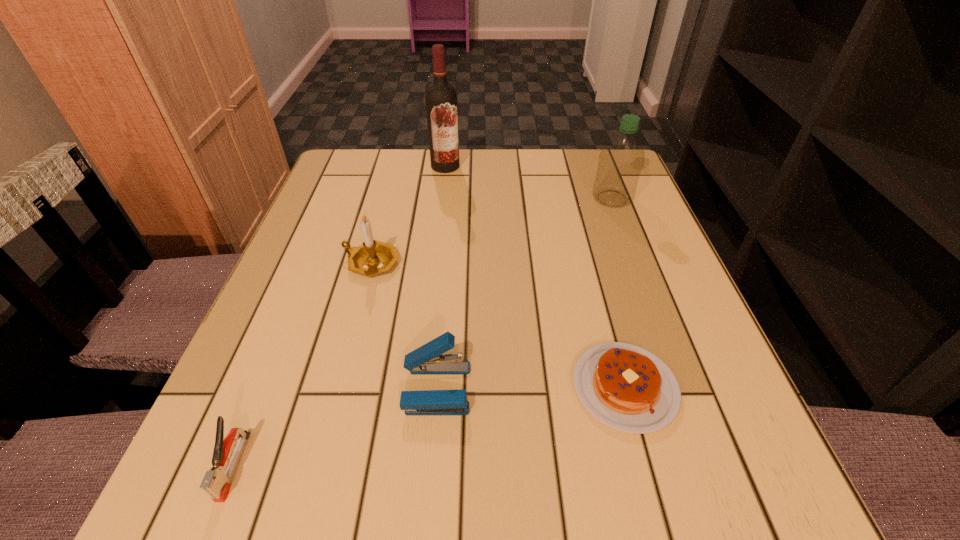
This screenshot has width=960, height=540. What are the coordinates of `free spot located on the label of the wine bottle` in the screenshot? It's located at tap(433, 276).

At what (x,y) coordinates should I click in order to perform the action: click on vacant space located on the front of the fifth shortest object. Please return your answer as a coordinate pair (x, y). This screenshot has width=960, height=540. Looking at the image, I should click on (622, 224).

Where is `free region located on the back of the candle holder`? free region located on the back of the candle holder is located at coordinates click(380, 228).

Where is `vacant space located 0.390m on the right of the farther stapler`? This screenshot has width=960, height=540. vacant space located 0.390m on the right of the farther stapler is located at coordinates (723, 388).

Locate an element on the screen. free space located on the left of the pancake is located at coordinates (398, 387).

Find the location of a particular element. Image resolution: width=960 pixels, height=540 pixels. wine bottle that is at the far edge is located at coordinates (441, 97).

You are a GUI agent. You are given a task and a screenshot of the screen. Output one action in this format:
    pyautogui.click(x=<x>, y=<y>)
    Task: Click on the water bottle positioned at the far edge
    This screenshot has height=540, width=960.
    Given the screenshot: What is the action you would take?
    pyautogui.click(x=621, y=159)

Where is `object at the near edge`? object at the near edge is located at coordinates (216, 483).

Find the location of `candle holder at the left edge`. candle holder at the left edge is located at coordinates (373, 257).

At what (x,y) coordinates should I click in order to perform the action: click on stapler located at the left edge. Please return your answer as a coordinate pair (x, y). Looking at the image, I should click on (216, 483).